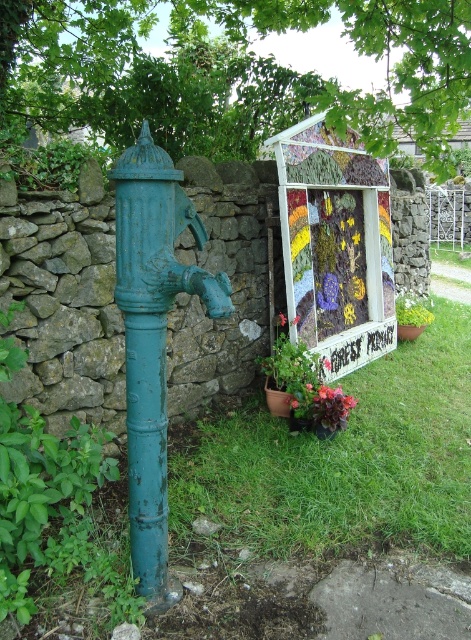
You are standing at the center of the image and want to place a small potted plant exactly where the green grass at lower center is located. What are the coordinates where you should place the potted plant?

You should place the potted plant at point (344, 460) where the green grass at lower center is located.